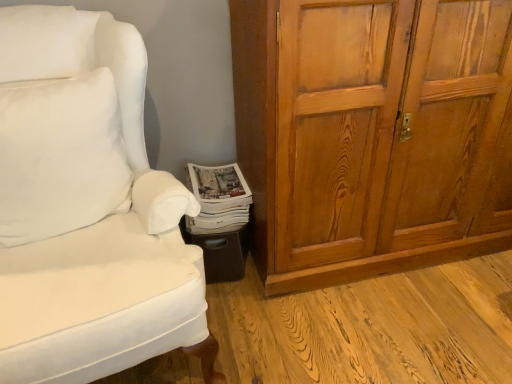
Question: Is wooden cabinet at right not within white fabric chair at lower left?

Choices:
 (A) no
 (B) yes

Answer: (B)

Question: Is wooden cabinet at right beside white fabric chair at lower left?

Choices:
 (A) no
 (B) yes

Answer: (A)

Question: Can you confirm if wooden cabinet at right is positioned to the left of white fabric chair at lower left?

Choices:
 (A) yes
 (B) no

Answer: (B)

Question: From the image's perspective, is wooden cabinet at right beneath white fabric chair at lower left?

Choices:
 (A) no
 (B) yes

Answer: (A)

Question: Is wooden cabinet at right thinner than white fabric chair at lower left?

Choices:
 (A) no
 (B) yes

Answer: (B)

Question: Is white fabric chair at lower left bigger or smaller than wooden cabinet at right?

Choices:
 (A) big
 (B) small

Answer: (B)

Question: From a real-world perspective, is white fabric chair at lower left positioned above or below wooden cabinet at right?

Choices:
 (A) below
 (B) above

Answer: (A)

Question: Is white fabric chair at lower left inside or outside of wooden cabinet at right?

Choices:
 (A) inside
 (B) outside

Answer: (B)

Question: Visually, is white fabric chair at lower left positioned to the left or to the right of wooden cabinet at right?

Choices:
 (A) right
 (B) left

Answer: (B)

Question: Visually, is wooden cabinet at right positioned to the left or to the right of white glossy magazine at lower center?

Choices:
 (A) right
 (B) left

Answer: (A)

Question: From the image's perspective, is wooden cabinet at right positioned above or below white glossy magazine at lower center?

Choices:
 (A) above
 (B) below

Answer: (A)

Question: Considering the positions of wooden cabinet at right and white glossy magazine at lower center in the image, is wooden cabinet at right bigger or smaller than white glossy magazine at lower center?

Choices:
 (A) small
 (B) big

Answer: (B)

Question: Is wooden cabinet at right situated inside white glossy magazine at lower center or outside?

Choices:
 (A) outside
 (B) inside

Answer: (A)

Question: From a real-world perspective, is white soft pillow at left positioned above or below wooden cabinet at right?

Choices:
 (A) above
 (B) below

Answer: (A)

Question: From the image's perspective, is white soft pillow at left above or below wooden cabinet at right?

Choices:
 (A) above
 (B) below

Answer: (B)